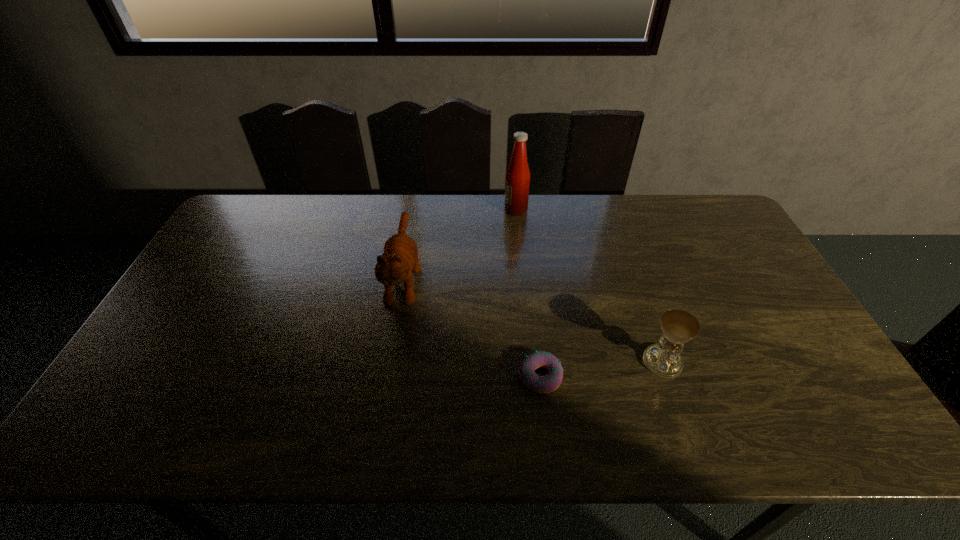
This screenshot has width=960, height=540. I want to click on vacant area that lies between the third nearest object and the rightmost object, so click(533, 319).

In order to click on vacant space in between the second tallest object and the doughnut in this screenshot , I will do click(x=472, y=326).

The width and height of the screenshot is (960, 540). I want to click on free point between the cat and the farthest object, so click(x=460, y=243).

Where is `empty space that is in between the farthest object and the leftmost object`? The height and width of the screenshot is (540, 960). empty space that is in between the farthest object and the leftmost object is located at coordinates (460, 243).

The image size is (960, 540). Find the location of `unoccupied area between the chalice and the leftmost object`. unoccupied area between the chalice and the leftmost object is located at coordinates (533, 319).

Locate an element on the screen. This screenshot has width=960, height=540. vacant region between the farthest object and the rightmost object is located at coordinates (589, 286).

Identify the location of empty space between the third nearest object and the shortest object. The width and height of the screenshot is (960, 540). (472, 326).

The height and width of the screenshot is (540, 960). Identify the location of free spot between the doughnut and the farthest object. (528, 293).

Locate an element on the screen. The image size is (960, 540). vacant area that lies between the rightmost object and the third shortest object is located at coordinates (533, 319).

Where is `object that stands as the second closest to the third nearest object`? This screenshot has height=540, width=960. object that stands as the second closest to the third nearest object is located at coordinates (548, 383).